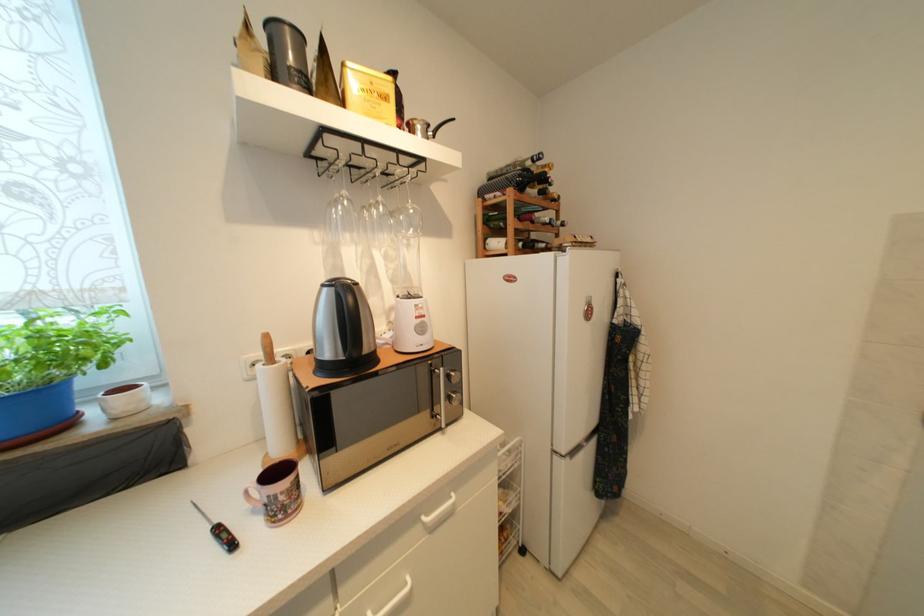
What do you see at coordinates (275, 492) in the screenshot?
I see `the pink mug handle` at bounding box center [275, 492].